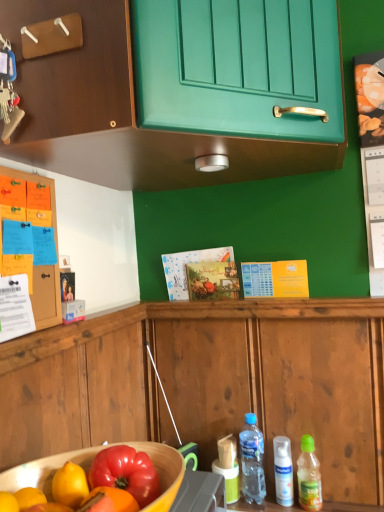
Question: Is green matte cabinet at upper center, the 2th cabinetry when ordered from bottom to top, at the right side of white matte spray can at lower right, the 2th bottle when ordered from right to left?

Choices:
 (A) no
 (B) yes

Answer: (A)

Question: Can you confirm if green matte cabinet at upper center, the 2th cabinetry when ordered from bottom to top, is smaller than white matte spray can at lower right, the 2th bottle when ordered from right to left?

Choices:
 (A) no
 (B) yes

Answer: (A)

Question: Does green matte cabinet at upper center, the 2th cabinetry when ordered from bottom to top, have a greater height compared to white matte spray can at lower right, the 2th bottle from the left?

Choices:
 (A) no
 (B) yes

Answer: (B)

Question: Would you say white matte spray can at lower right, the 2th bottle when ordered from right to left, is part of green matte cabinet at upper center, which is counted as the first cabinetry, starting from the top,'s contents?

Choices:
 (A) no
 (B) yes

Answer: (A)

Question: Is green matte cabinet at upper center, the 2th cabinetry when ordered from bottom to top, turned away from white matte spray can at lower right, the 2th bottle from the left?

Choices:
 (A) no
 (B) yes

Answer: (A)

Question: From a real-world perspective, is translucent plastic bottle at lower center, positioned as the first bottle in left-to-right order, physically located above or below green plastic bottle at lower right, which is counted as the third bottle, starting from the left?

Choices:
 (A) below
 (B) above

Answer: (B)

Question: In terms of width, does translucent plastic bottle at lower center, positioned as the first bottle in left-to-right order, look wider or thinner when compared to green plastic bottle at lower right, which is counted as the third bottle, starting from the left?

Choices:
 (A) thin
 (B) wide

Answer: (B)

Question: Considering the positions of point (263, 499) and point (314, 466), is point (263, 499) closer or farther from the camera than point (314, 466)?

Choices:
 (A) farther
 (B) closer

Answer: (A)

Question: From their relative heights in the image, would you say translucent plastic bottle at lower center, arranged as the third bottle when viewed from the right, is taller or shorter than green plastic bottle at lower right, which is counted as the third bottle, starting from the left?

Choices:
 (A) short
 (B) tall

Answer: (B)

Question: From their relative heights in the image, would you say green matte cabinet at upper center, the 2th cabinetry when ordered from bottom to top, is taller or shorter than white matte spray can at lower right, the 2th bottle when ordered from right to left?

Choices:
 (A) short
 (B) tall

Answer: (B)

Question: Considering the positions of green matte cabinet at upper center, the 2th cabinetry when ordered from bottom to top, and white matte spray can at lower right, the 2th bottle when ordered from right to left, in the image, is green matte cabinet at upper center, the 2th cabinetry when ordered from bottom to top, wider or thinner than white matte spray can at lower right, the 2th bottle when ordered from right to left,?

Choices:
 (A) wide
 (B) thin

Answer: (A)

Question: Visually, is green matte cabinet at upper center, which is counted as the first cabinetry, starting from the top, positioned to the left or to the right of white matte spray can at lower right, the 2th bottle when ordered from right to left?

Choices:
 (A) left
 (B) right

Answer: (A)

Question: From the image's perspective, is green matte cabinet at upper center, which is counted as the first cabinetry, starting from the top, located above or below white matte spray can at lower right, the 2th bottle from the left?

Choices:
 (A) below
 (B) above

Answer: (B)

Question: Based on their positions, is wooden bowl at lower left located to the left or right of wooden cabinet at left, the 1th cabinetry in the bottom-to-top sequence?

Choices:
 (A) right
 (B) left

Answer: (A)

Question: From the image's perspective, relative to wooden cabinet at left, the 1th cabinetry in the bottom-to-top sequence, is wooden bowl at lower left above or below?

Choices:
 (A) above
 (B) below

Answer: (B)